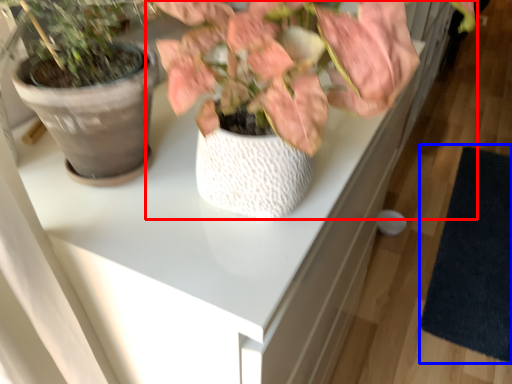
Question: Among these objects, which one is nearest to the camera, houseplant (highlighted by a red box) or mat (highlighted by a blue box)?

Choices:
 (A) houseplant
 (B) mat

Answer: (A)